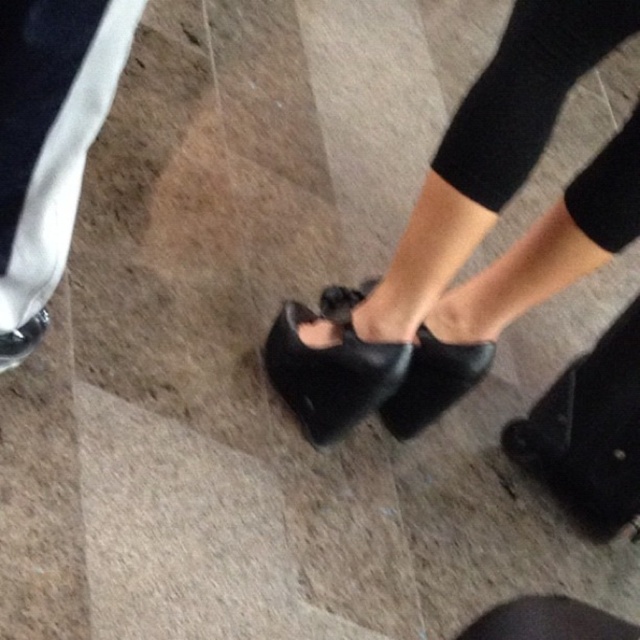
Question: Which object is positioned farthest from the black knit tights at center?

Choices:
 (A) black leather sandal at center
 (B) matte black shoe at lower center
 (C) black leather shoe at center

Answer: (B)

Question: Is black leather sandal at center wider than matte black shoe at lower center?

Choices:
 (A) yes
 (B) no

Answer: (A)

Question: Which object is farther from the camera taking this photo?

Choices:
 (A) black leather shoe at center
 (B) matte black shoe at lower center
 (C) black leather sandal at center
 (D) black knit tights at center

Answer: (A)

Question: Does black leather sandal at center have a greater width compared to black leather shoe at center?

Choices:
 (A) no
 (B) yes

Answer: (B)

Question: Which point is closer to the camera?

Choices:
 (A) (440, 397)
 (B) (330, 404)
 (C) (13, 330)
 (D) (561, 100)

Answer: (D)

Question: Is black leather shoe at center closer to the viewer compared to matte black shoe at lower center?

Choices:
 (A) yes
 (B) no

Answer: (B)